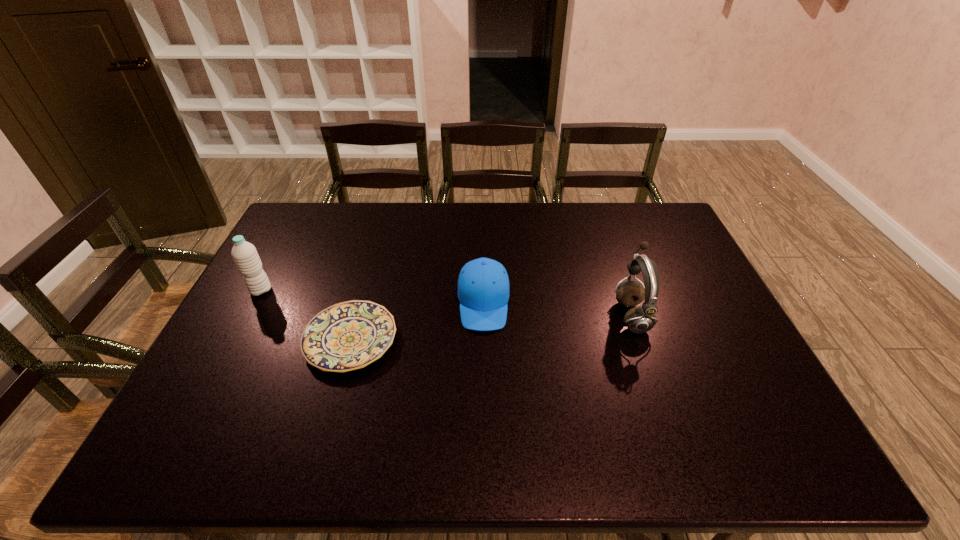
Find the location of a particular element. free space located on the front-facing side of the cap is located at coordinates (485, 449).

This screenshot has width=960, height=540. Identify the location of blank area located on the left of the plate. (260, 340).

Find the location of `object that is at the left edge`. object that is at the left edge is located at coordinates (246, 258).

In the image, there is a desktop. Where is `vacant space at the far edge`? vacant space at the far edge is located at coordinates (588, 228).

In the image, there is a desktop. Where is `free region at the near edge`? This screenshot has width=960, height=540. free region at the near edge is located at coordinates (462, 434).

In the image, there is a desktop. Where is `vacant space at the left edge`? The width and height of the screenshot is (960, 540). vacant space at the left edge is located at coordinates (239, 347).

Find the location of a particular element. The image size is (960, 540). vacant area at the right edge is located at coordinates (722, 341).

In the image, there is a desktop. Identify the location of free space at the far left corner. (320, 225).

The width and height of the screenshot is (960, 540). In order to click on vacant space that is in between the cap and the rightmost object in this screenshot , I will do `click(558, 309)`.

At what (x,y) coordinates should I click in order to perform the action: click on vacant area that lies between the cap and the earphone. Please return your answer as a coordinate pair (x, y). The width and height of the screenshot is (960, 540). Looking at the image, I should click on (558, 309).